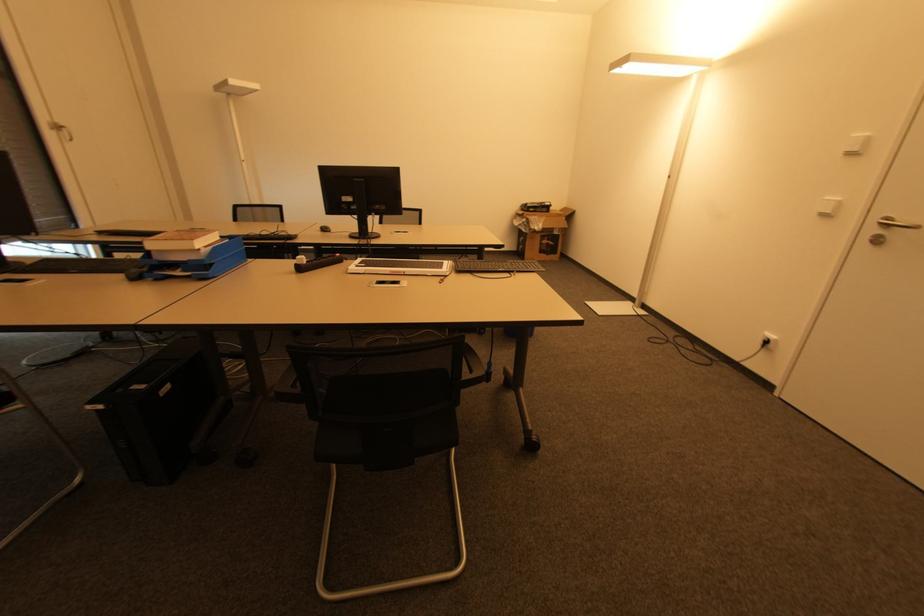
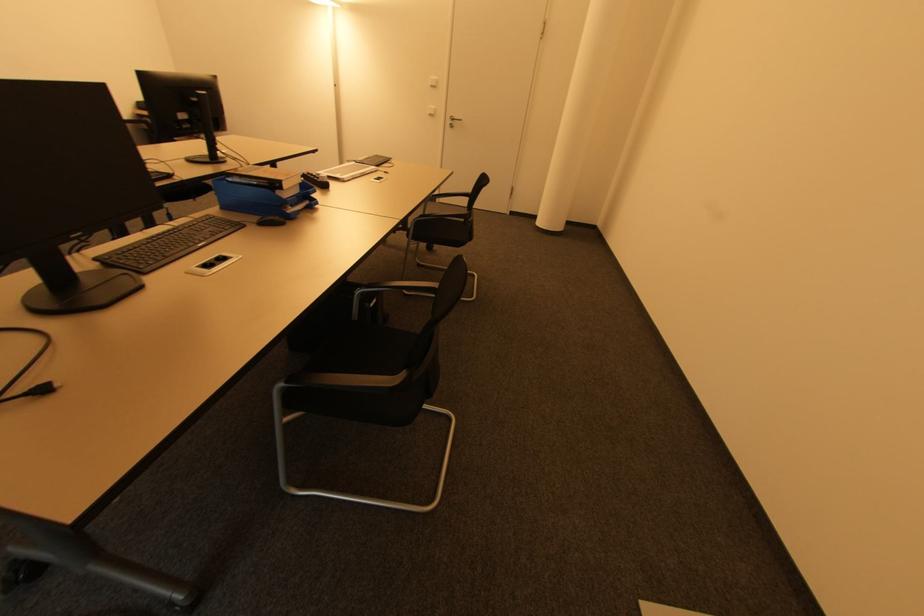
In the second image, find the point that corresponds to point 186,272 in the first image.

(294, 207)